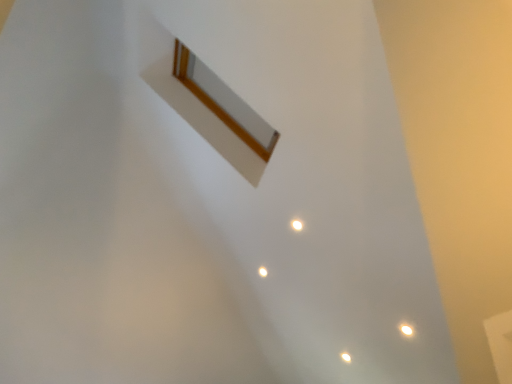
Question: Should I look upward or downward to see white glossy light at lower right?

Choices:
 (A) down
 (B) up

Answer: (A)